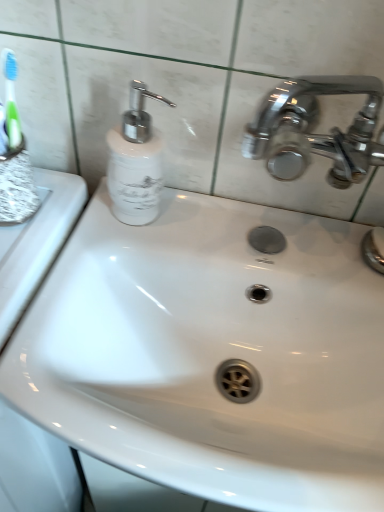
Question: From the image's perspective, would you say polished chrome faucet at upper right is positioned over white glossy soap dispenser at upper left?

Choices:
 (A) no
 (B) yes

Answer: (A)

Question: Considering the relative sizes of polished chrome faucet at upper right and white glossy soap dispenser at upper left in the image provided, is polished chrome faucet at upper right smaller than white glossy soap dispenser at upper left?

Choices:
 (A) no
 (B) yes

Answer: (B)

Question: Is polished chrome faucet at upper right shorter than white glossy soap dispenser at upper left?

Choices:
 (A) yes
 (B) no

Answer: (A)

Question: Is polished chrome faucet at upper right located outside white glossy soap dispenser at upper left?

Choices:
 (A) no
 (B) yes

Answer: (B)

Question: Is polished chrome faucet at upper right closer to the viewer compared to white glossy soap dispenser at upper left?

Choices:
 (A) yes
 (B) no

Answer: (B)

Question: Can you confirm if polished chrome faucet at upper right is positioned to the left of white glossy soap dispenser at upper left?

Choices:
 (A) yes
 (B) no

Answer: (B)

Question: From a real-world perspective, is white glossy soap dispenser at upper left physically below polished chrome faucet at upper right?

Choices:
 (A) no
 (B) yes

Answer: (A)

Question: Can you confirm if white glossy soap dispenser at upper left is bigger than polished chrome faucet at upper right?

Choices:
 (A) no
 (B) yes

Answer: (B)

Question: Can we say white glossy soap dispenser at upper left lies outside polished chrome faucet at upper right?

Choices:
 (A) no
 (B) yes

Answer: (B)

Question: Is white glossy soap dispenser at upper left oriented towards polished chrome faucet at upper right?

Choices:
 (A) no
 (B) yes

Answer: (A)

Question: From a real-world perspective, is white glossy soap dispenser at upper left on polished chrome faucet at upper right?

Choices:
 (A) no
 (B) yes

Answer: (B)

Question: Is white glossy soap dispenser at upper left touching polished chrome faucet at upper right?

Choices:
 (A) no
 (B) yes

Answer: (A)

Question: Choose the correct answer: Is polished chrome faucet at upper right inside white glossy soap dispenser at upper left or outside it?

Choices:
 (A) outside
 (B) inside

Answer: (A)